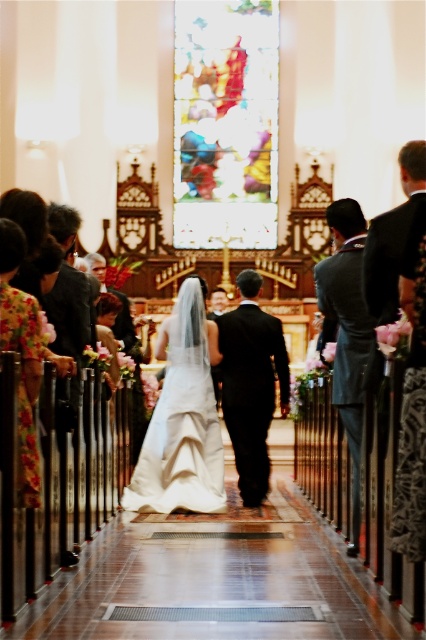
You are a photographer positioned at the back of the church aisle. You need to capture a photo of the white satin dress at center and the black satin suit at center. Based on their positions, which one is closer to the camera?

The white satin dress at center is located above the black satin suit at center, so the white satin dress at center is closer to the camera.

You are a photographer positioned at the back of the church aisle. You need to capture a photo of both the white satin dress at center and the black satin suit at center in the same frame. Based on their positions, which one should you adjust your camera focus to prioritize to ensure both are in the shot?

The white satin dress at center is to the left of the black satin suit at center, so you should adjust your camera focus to prioritize the left side to ensure both are in the shot.